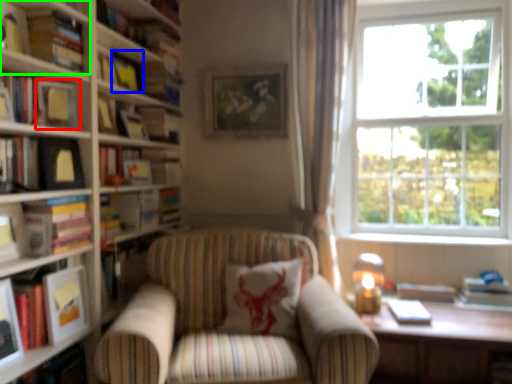
Question: Which is nearer to the picture frame (highlighted by a red box)? picture frame (highlighted by a blue box) or book (highlighted by a green box).

Choices:
 (A) picture frame
 (B) book

Answer: (B)